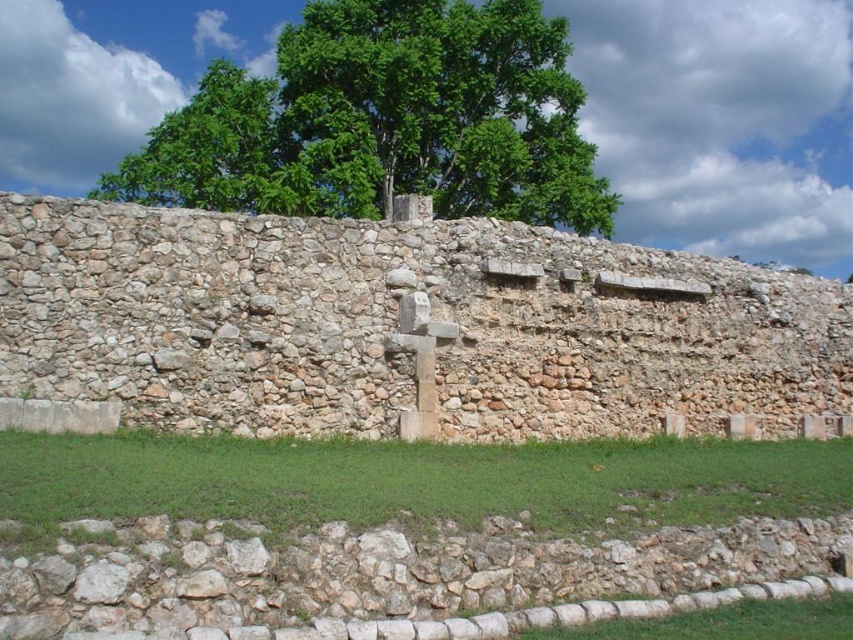
You are standing in front of the rustic stone wall at center and the smooth stone cross at center. Which object is positioned to the left?

The smooth stone cross at center is positioned to the left of the rustic stone wall at center.

You are standing in front of the ancient stone wall and want to take a photo that includes both the green leafy tree at upper center and the smooth stone cross at center. Which object should you ensure is closer to the camera to include both in the frame?

The green leafy tree at upper center is taller than the smooth stone cross at center, so to include both in the frame, you should position yourself closer to the shorter smooth stone cross at center.